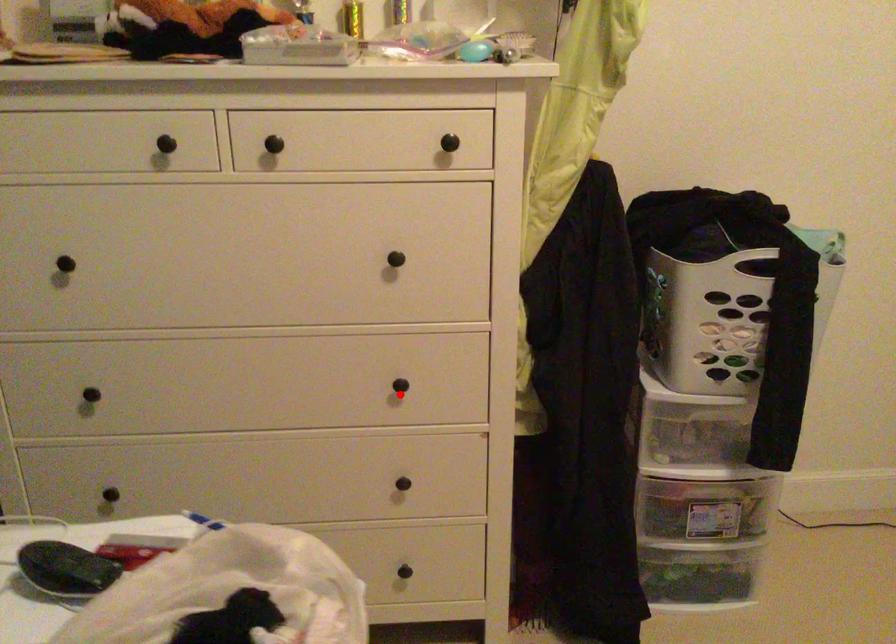
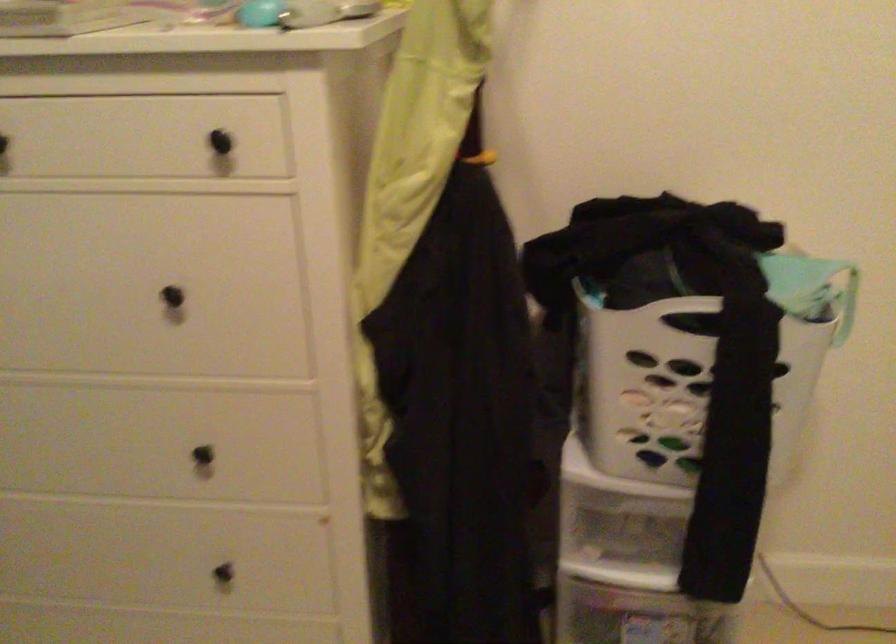
Question: I am providing you with two images of the same scene from different viewpoints. A red point is shown in image1. For the corresponding object point in image2, is it positioned nearer or farther from the camera?

Choices:
 (A) Nearer
 (B) Farther

Answer: (A)